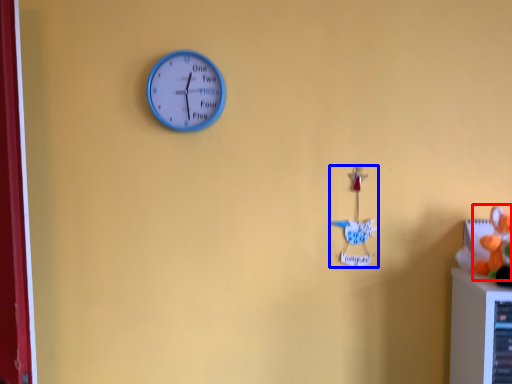
Question: Which point is closer to the camera, toy (highlighted by a red box) or toy (highlighted by a blue box)?

Choices:
 (A) toy
 (B) toy

Answer: (A)